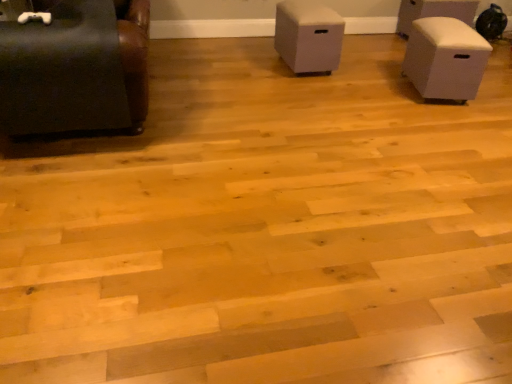
Question: Is beige matte storage box at right, which is counted as the third furniture, starting from the left, turned away from white matte storage box at center, which is the third furniture from front to back?

Choices:
 (A) no
 (B) yes

Answer: (A)

Question: Can you confirm if beige matte storage box at right, the third furniture viewed from the back, is taller than white matte storage box at center, which is the third furniture from front to back?

Choices:
 (A) yes
 (B) no

Answer: (A)

Question: Does beige matte storage box at right, which is counted as the second furniture, starting from the right, have a larger size compared to white matte storage box at center, placed as the second furniture when sorted from back to front?

Choices:
 (A) yes
 (B) no

Answer: (A)

Question: Is beige matte storage box at right, placed as the second furniture when sorted from front to back, next to white matte storage box at center, placed as the second furniture when sorted from back to front?

Choices:
 (A) yes
 (B) no

Answer: (B)

Question: From a real-world perspective, is beige matte storage box at right, placed as the second furniture when sorted from front to back, beneath white matte storage box at center, acting as the third furniture starting from the right?

Choices:
 (A) no
 (B) yes

Answer: (B)

Question: Based on their sizes in the image, would you say white matte storage box at center, which is the third furniture from front to back, is bigger or smaller than beige matte storage box at right, placed as the second furniture when sorted from front to back?

Choices:
 (A) small
 (B) big

Answer: (A)

Question: Is point (288, 21) closer or farther from the camera than point (429, 74)?

Choices:
 (A) closer
 (B) farther

Answer: (B)

Question: From a real-world perspective, is white matte storage box at center, which is the third furniture from front to back, positioned above or below beige matte storage box at right, placed as the second furniture when sorted from front to back?

Choices:
 (A) above
 (B) below

Answer: (A)

Question: Relative to beige matte storage box at right, the third furniture viewed from the back, is white matte storage box at center, placed as the second furniture when sorted from back to front, in front or behind?

Choices:
 (A) behind
 (B) front

Answer: (A)

Question: In terms of width, does white fabric ottoman at upper right, positioned as the 1th furniture in right-to-left order, look wider or thinner when compared to matte black couch at left, marked as the first furniture in a left-to-right arrangement?

Choices:
 (A) wide
 (B) thin

Answer: (B)

Question: Is point (401, 9) positioned closer to the camera than point (10, 56)?

Choices:
 (A) closer
 (B) farther

Answer: (B)

Question: Relative to matte black couch at left, the 1th furniture positioned from the front, is white fabric ottoman at upper right, marked as the 4th furniture in a front-to-back arrangement, in front or behind?

Choices:
 (A) front
 (B) behind

Answer: (B)

Question: From the image's perspective, relative to matte black couch at left, the fourth furniture positioned from the back, is white fabric ottoman at upper right, which is counted as the 4th furniture, starting from the left, above or below?

Choices:
 (A) above
 (B) below

Answer: (A)

Question: Relative to white matte storage box at center, which is counted as the 2th furniture, starting from the left, is white fabric ottoman at upper right, which is counted as the 4th furniture, starting from the left, in front or behind?

Choices:
 (A) behind
 (B) front

Answer: (A)

Question: From their relative heights in the image, would you say white fabric ottoman at upper right, marked as the 4th furniture in a front-to-back arrangement, is taller or shorter than white matte storage box at center, placed as the second furniture when sorted from back to front?

Choices:
 (A) short
 (B) tall

Answer: (A)